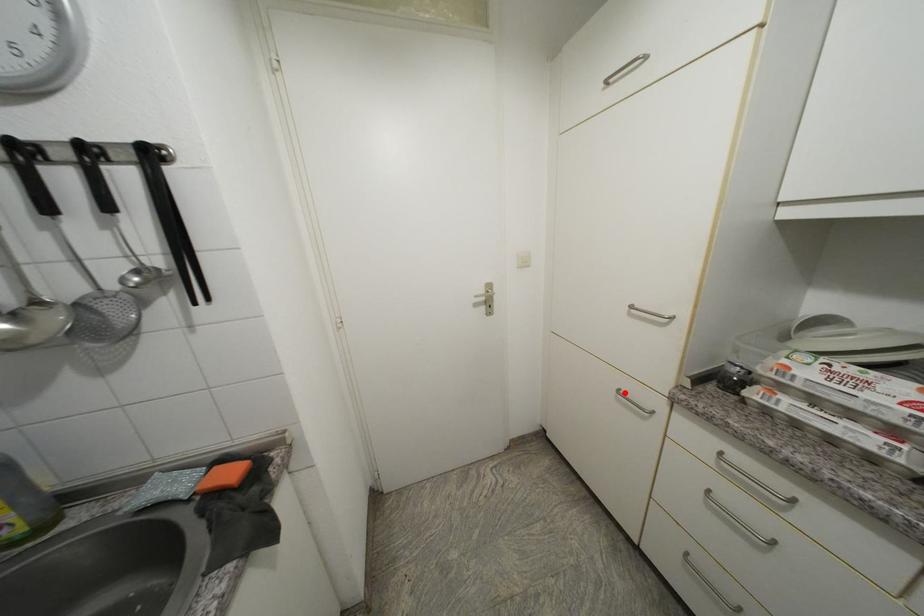
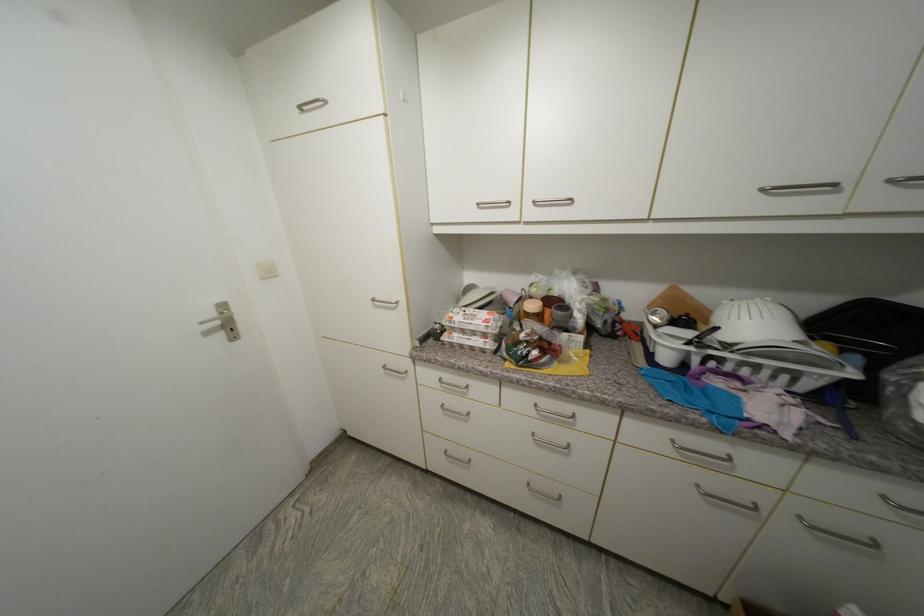
Question: A red point is marked in image1. In image2, is the corresponding 3D point closer to the camera or farther? Reply with the corresponding letter.

Choices:
 (A) The corresponding 3D point is closer.
 (B) The corresponding 3D point is farther.

Answer: (B)